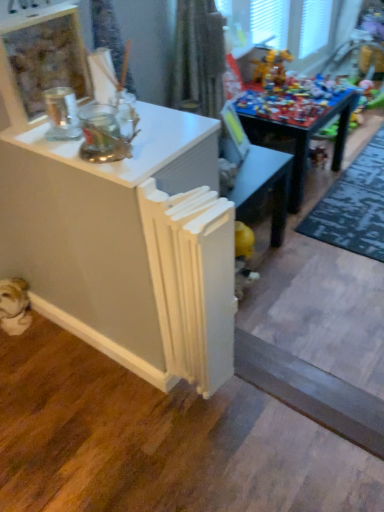
What is the approximate height of wooden toy at center?

wooden toy at center is 17.90 inches tall.

What is the approximate height of clear glass jar at upper left?

The height of clear glass jar at upper left is 9.98 inches.

Where is `gray matte wood plank at lower right`? Image resolution: width=384 pixels, height=512 pixels. gray matte wood plank at lower right is located at coordinates (312, 392).

Locate an element on the screen. Image resolution: width=384 pixels, height=512 pixels. shiny plastic toy at upper right is located at coordinates (271, 67).

What do you see at coordinates (271, 67) in the screenshot? I see `shiny plastic toy at upper right` at bounding box center [271, 67].

You are a GUI agent. You are given a task and a screenshot of the screen. Output one action in this format:
    pyautogui.click(x=<x>, y=<y>)
    Task: Click on the wooden toy at center
    The height and width of the screenshot is (512, 384).
    Given the screenshot: What is the action you would take?
    pyautogui.click(x=297, y=129)

Is clear glass jar at upper left thinner than green textured rug at lower right?

Indeed, clear glass jar at upper left has a lesser width compared to green textured rug at lower right.

Between clear glass jar at upper left and green textured rug at lower right, which one has more height?

clear glass jar at upper left.

From a real-world perspective, is clear glass jar at upper left below green textured rug at lower right?

No, from a real-world perspective, clear glass jar at upper left is not beneath green textured rug at lower right.

Are clear glass jar at upper left and green textured rug at lower right making contact?

clear glass jar at upper left and green textured rug at lower right are not in contact.

In the scene shown: Which object is closer to the camera, white matte radiator at center or wooden toy at center?

white matte radiator at center is more forward.

Considering the positions of points (217, 309) and (264, 116), is point (217, 309) farther from camera compared to point (264, 116)?

No.

Are white matte radiator at center and wooden toy at center making contact?

No, white matte radiator at center is not beside wooden toy at center.

From the image's perspective, is white matte radiator at center located beneath wooden toy at center?

Yes.

Can you confirm if wooden toy at center is shorter than gray matte wood plank at lower right?

Incorrect, the height of wooden toy at center does not fall short of that of gray matte wood plank at lower right.

Where is `plank on the left of wooden toy at center`? plank on the left of wooden toy at center is located at coordinates (312, 392).

From the image's perspective, is wooden toy at center located above or below gray matte wood plank at lower right?

Based on their image positions, wooden toy at center is located above gray matte wood plank at lower right.

Does wooden toy at center turn towards gray matte wood plank at lower right?

No.

How much distance is there between wooden toy at center and shiny plastic toy at upper right?

wooden toy at center and shiny plastic toy at upper right are 12.50 inches apart.

In the scene shown: Is wooden toy at center placed right next to shiny plastic toy at upper right?

No, wooden toy at center is not in contact with shiny plastic toy at upper right.

From a real-world perspective, is wooden toy at center on top of shiny plastic toy at upper right?

Incorrect, from a real-world perspective, wooden toy at center is lower than shiny plastic toy at upper right.

Considering the positions of point (347, 122) and point (289, 53), is point (347, 122) closer or farther from the camera than point (289, 53)?

Point (347, 122).

Between green textured rug at lower right and white fur dog at lower left, which one has larger size?

Bigger between the two is green textured rug at lower right.

Considering the positions of objects green textured rug at lower right and white fur dog at lower left in the image provided, who is more to the right, green textured rug at lower right or white fur dog at lower left?

green textured rug at lower right.

Can you confirm if green textured rug at lower right is wider than white fur dog at lower left?

Yes.

Is shiny plastic toy at upper right completely or partially outside of white fur dog at lower left?

Indeed, shiny plastic toy at upper right is completely outside white fur dog at lower left.

How distant is shiny plastic toy at upper right from white fur dog at lower left?

shiny plastic toy at upper right is 1.60 meters from white fur dog at lower left.

Considering the positions of points (262, 80) and (15, 333), is point (262, 80) closer to camera compared to point (15, 333)?

No, it is not.

Based on the photo, is shiny plastic toy at upper right with white fur dog at lower left?

shiny plastic toy at upper right is not next to white fur dog at lower left, and they're not touching.

Which object is positioned more to the left, white matte radiator at center or clear glass jar at upper left?

clear glass jar at upper left is more to the left.

How many degrees apart are the facing directions of white matte radiator at center and clear glass jar at upper left?

The angular difference between white matte radiator at center and clear glass jar at upper left is 0.0106 degrees.

Is white matte radiator at center far from clear glass jar at upper left?

No, there isn't a large distance between white matte radiator at center and clear glass jar at upper left.

Where is `shelf that is above the white matte radiator at center (from a real-world perspective)`? shelf that is above the white matte radiator at center (from a real-world perspective) is located at coordinates (41, 61).

Locate an element on the screen. This screenshot has width=384, height=512. doormat located behind the clear glass jar at upper left is located at coordinates (353, 205).

Identify the location of radiator below the wooden toy at center (from the image's perspective). This screenshot has width=384, height=512. (192, 281).

Estimate the real-world distances between objects in this image. Which object is closer to clear glass jar at upper left, green textured rug at lower right or shiny plastic toy at upper right?

shiny plastic toy at upper right lies closer to clear glass jar at upper left than the other object.

From the image, which object appears to be nearer to clear glass jar at upper left, white fur dog at lower left or gray matte wood plank at lower right?

Based on the image, white fur dog at lower left appears to be nearer to clear glass jar at upper left.

Estimate the real-world distances between objects in this image. Which object is closer to white fur dog at lower left, wooden toy at center or clear glass jar at upper left?

Among the two, clear glass jar at upper left is located nearer to white fur dog at lower left.

From the picture: Looking at the image, which one is located further to wooden toy at center, green textured rug at lower right or gray matte wood plank at lower right?

Based on the image, gray matte wood plank at lower right appears to be further to wooden toy at center.

Looking at the image, which one is located further to gray matte wood plank at lower right, white matte radiator at center or green textured rug at lower right?

green textured rug at lower right lies further to gray matte wood plank at lower right than the other object.

Estimate the real-world distances between objects in this image. Which object is further from wooden toy at center, shiny plastic toy at upper right or white fur dog at lower left?

white fur dog at lower left is positioned further to the anchor wooden toy at center.

Which object lies further to the anchor point white fur dog at lower left, clear glass jar at upper left or white matte radiator at center?

The object further to white fur dog at lower left is clear glass jar at upper left.

When comparing their distances from gray matte wood plank at lower right, does green textured rug at lower right or white matte radiator at center seem closer?

The object closer to gray matte wood plank at lower right is white matte radiator at center.

Identify the location of radiator between clear glass jar at upper left and white fur dog at lower left from top to bottom. (192, 281).

Find the location of a particular element. doormat between wooden toy at center and gray matte wood plank at lower right vertically is located at coordinates (353, 205).

The width and height of the screenshot is (384, 512). Find the location of `shelf between white matte radiator at center and wooden toy at center along the z-axis`. shelf between white matte radiator at center and wooden toy at center along the z-axis is located at coordinates (41, 61).

Where is `plank situated between white fur dog at lower left and green textured rug at lower right from left to right`? plank situated between white fur dog at lower left and green textured rug at lower right from left to right is located at coordinates (312, 392).